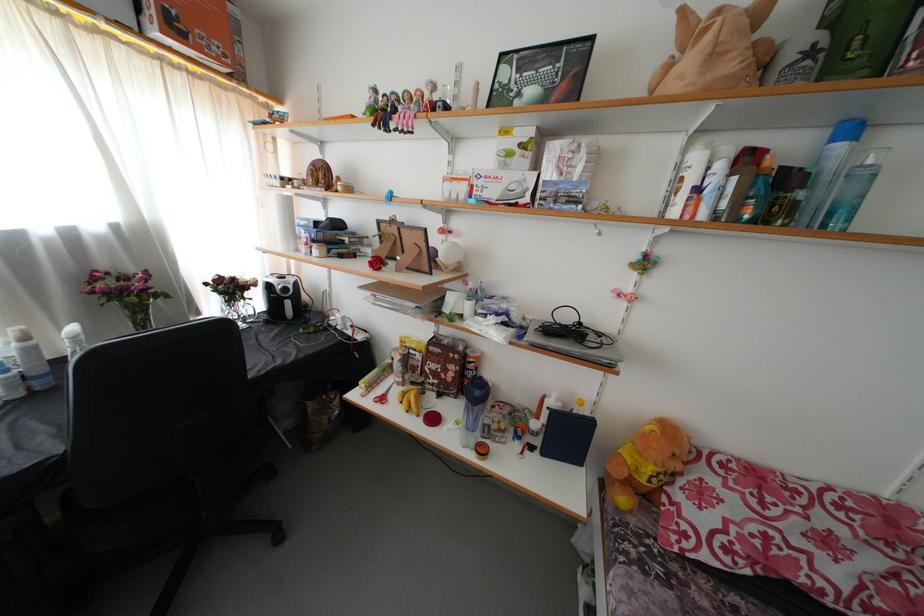
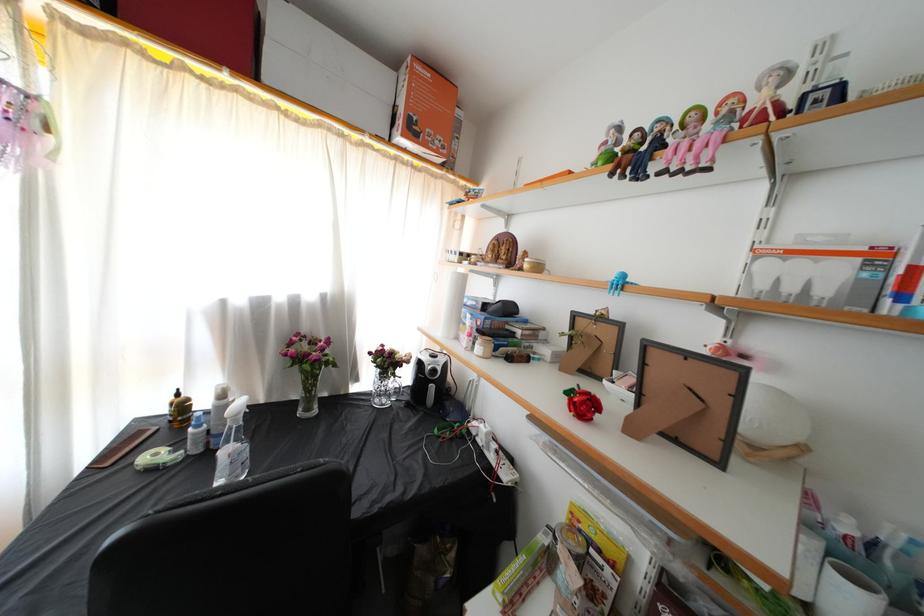
Question: I am providing you with two images of the same scene from different viewpoints. Which of the following objects are not visible in image2?

Choices:
 (A) orange cardboard box
 (B) brown plastic comb
 (C) small colorful doll
 (D) none of these

Answer: (D)